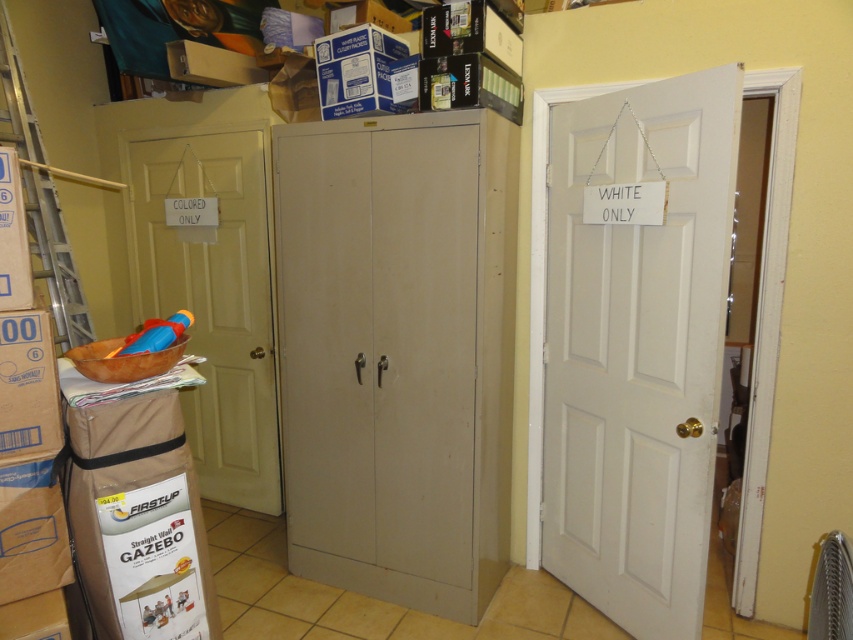
Is matte white door at left taller than silver metallic ladder at left?

Indeed, matte white door at left has a greater height compared to silver metallic ladder at left.

Is matte white door at left below silver metallic ladder at left?

Correct, matte white door at left is located below silver metallic ladder at left.

Locate an element on the screen. matte white door at left is located at coordinates [213, 298].

Does white matte door at right have a greater width compared to silver metallic ladder at left?

Indeed, white matte door at right has a greater width compared to silver metallic ladder at left.

Does white matte door at right have a smaller size compared to silver metallic ladder at left?

Incorrect, white matte door at right is not smaller in size than silver metallic ladder at left.

At what (x,y) coordinates should I click in order to perform the action: click on white matte door at right. Please return your answer as a coordinate pair (x, y). The width and height of the screenshot is (853, 640). Looking at the image, I should click on (637, 348).

Is point (566, 106) positioned before point (254, 138)?

Yes, it is.

Between white matte door at right and matte white door at left, which one has less height?

matte white door at left

Is point (605, 120) positioned behind point (242, 445)?

No, it is in front of (242, 445).

Find the location of a particular element. white matte door at right is located at coordinates (637, 348).